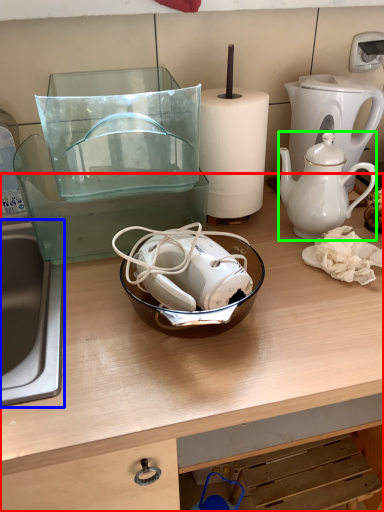
Question: Based on their relative distances, which object is farther from table (highlighted by a red box)? Choose from sink (highlighted by a blue box) and teapot (highlighted by a green box).

Choices:
 (A) sink
 (B) teapot

Answer: (B)